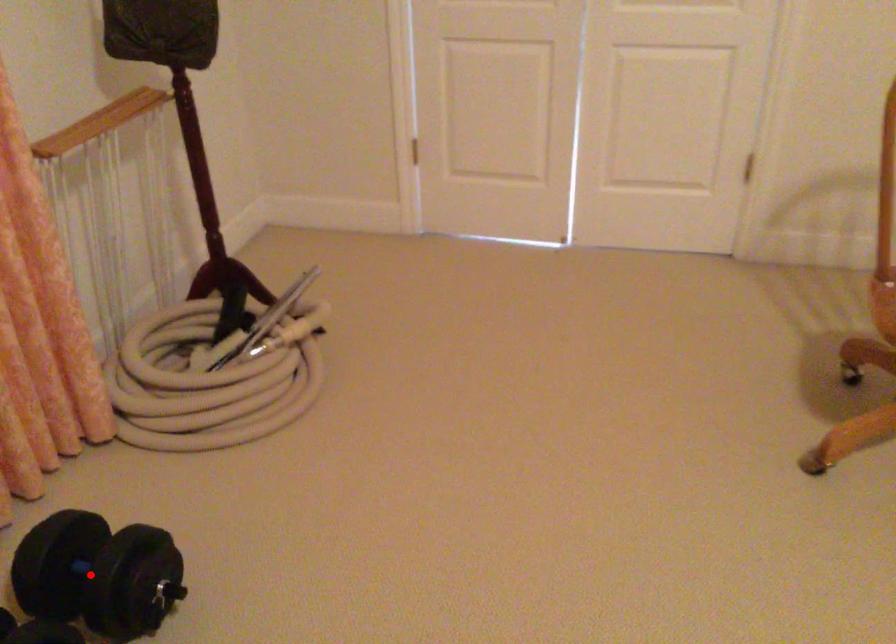
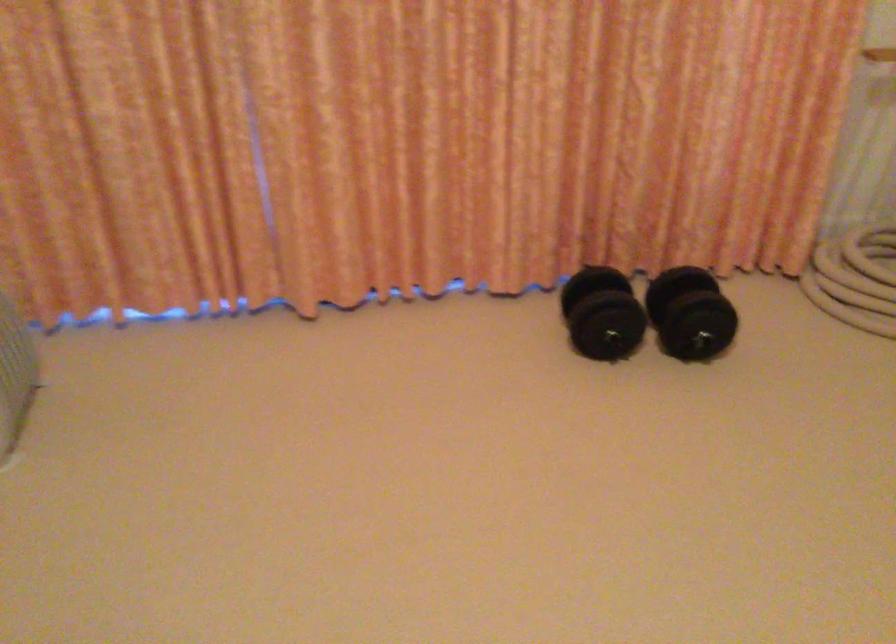
Find the pixel in the second image that matches the highlighted location in the first image.

(690, 313)